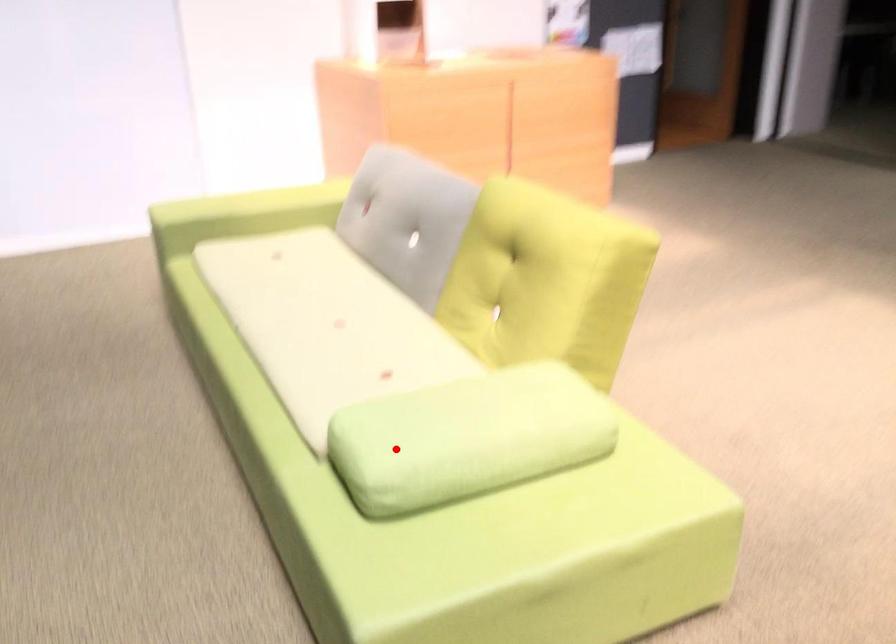
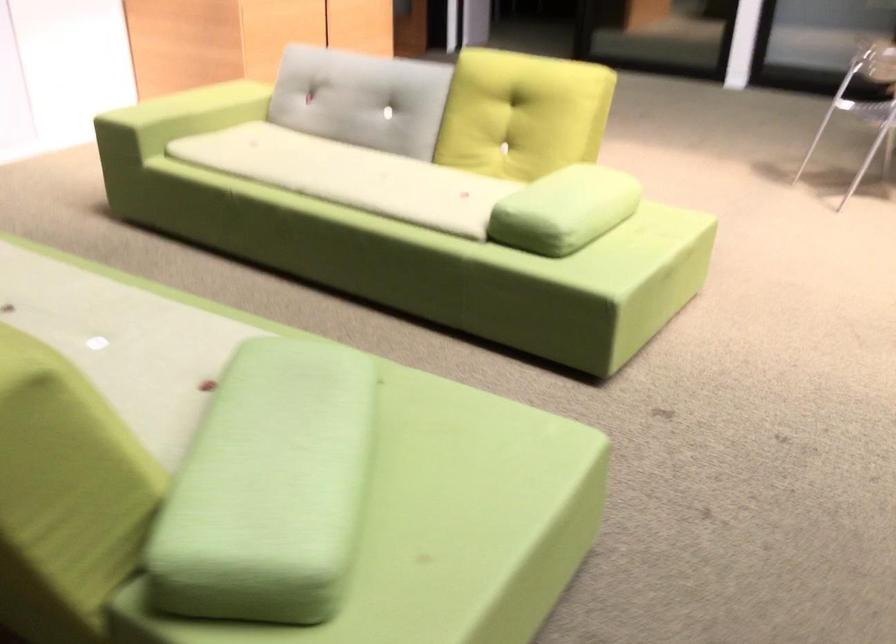
Locate, in the second image, the point that corresponds to the highlighted location in the first image.

(564, 210)